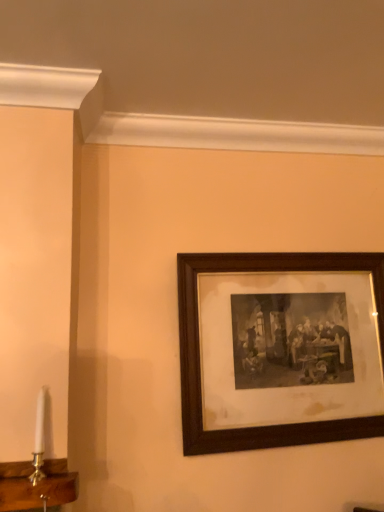
At what (x,y) coordinates should I click in order to perform the action: click on wooden frame at lower right. Please return your answer as a coordinate pair (x, y). The width and height of the screenshot is (384, 512). Looking at the image, I should click on (199, 352).

Image resolution: width=384 pixels, height=512 pixels. What do you see at coordinates (199, 352) in the screenshot?
I see `wooden frame at lower right` at bounding box center [199, 352].

Where is `wooden frame at lower right`? wooden frame at lower right is located at coordinates (199, 352).